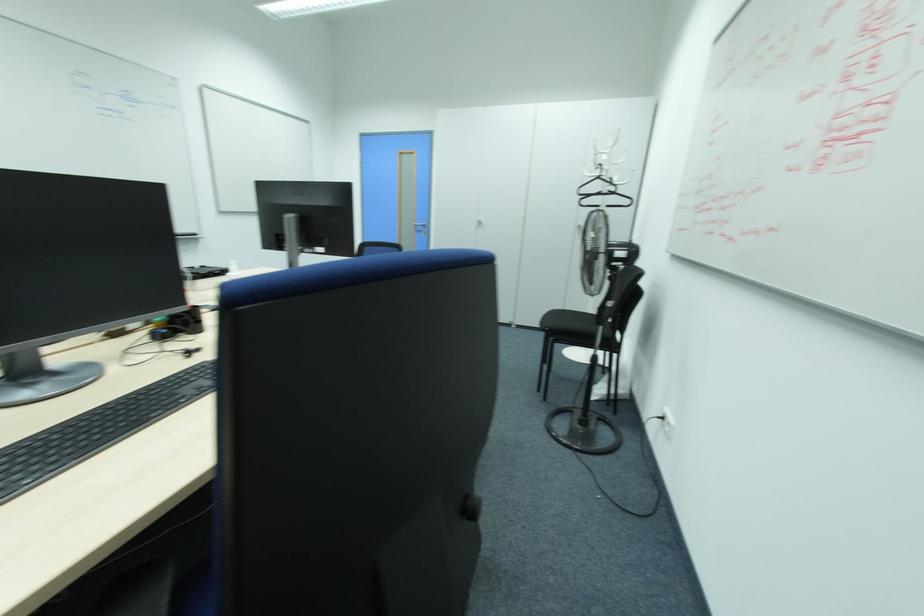
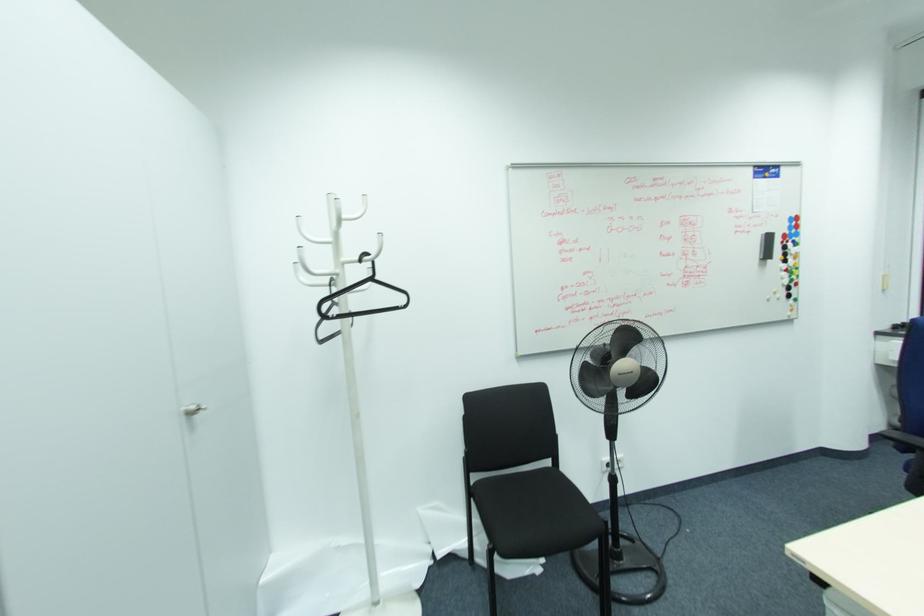
Find the pixel in the second image that matches point 599,177 in the first image.

(371, 280)